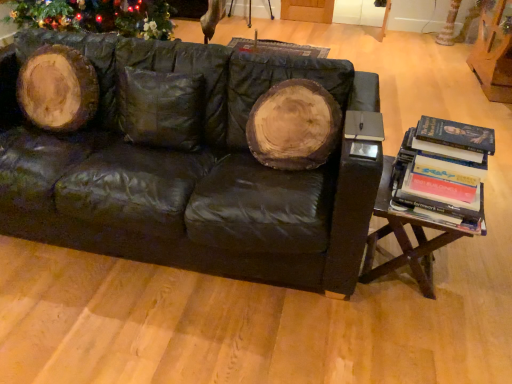
Image resolution: width=512 pixels, height=384 pixels. What are the coordinates of `free spot in front of white textured tree trunk at upper right` in the screenshot? It's located at (445, 52).